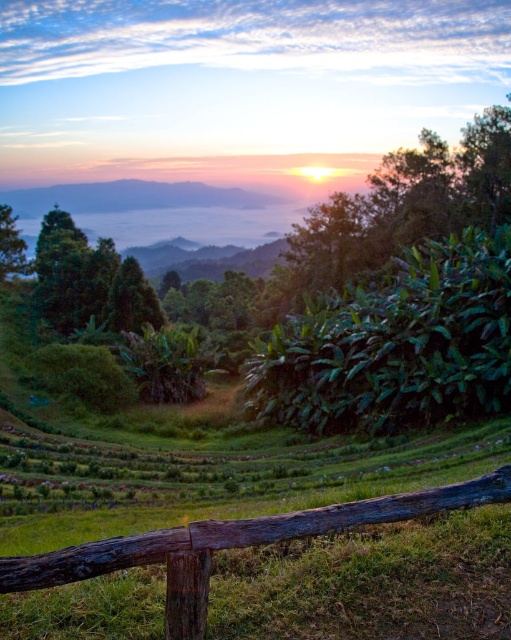
Is green leafy bush at center-right to the left of rustic wooden fence at lower center from the viewer's perspective?

In fact, green leafy bush at center-right is to the right of rustic wooden fence at lower center.

Which is in front, point (323, 330) or point (354, 579)?

Point (354, 579)

Does point (467, 294) come farther from viewer compared to point (396, 536)?

Yes.

The height and width of the screenshot is (640, 511). What are the coordinates of `green leafy bush at center-right` in the screenshot? It's located at (397, 346).